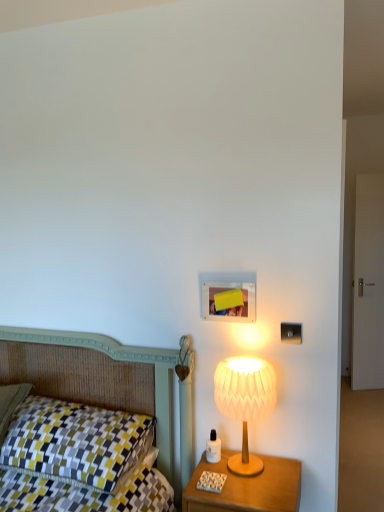
Question: From a real-world perspective, is white paper lampshade at right under wooden nightstand at right?

Choices:
 (A) yes
 (B) no

Answer: (B)

Question: Would you say white paper lampshade at right is a long distance from wooden nightstand at right?

Choices:
 (A) yes
 (B) no

Answer: (B)

Question: Is white paper lampshade at right at the right side of wooden nightstand at right?

Choices:
 (A) no
 (B) yes

Answer: (B)

Question: Can you confirm if white paper lampshade at right is smaller than wooden nightstand at right?

Choices:
 (A) no
 (B) yes

Answer: (B)

Question: Does white paper lampshade at right appear on the left side of wooden nightstand at right?

Choices:
 (A) no
 (B) yes

Answer: (A)

Question: Is white paper lampshade at right shorter than wooden nightstand at right?

Choices:
 (A) yes
 (B) no

Answer: (B)

Question: Is white paper lampshade at right taller than checkered fabric pillow at left?

Choices:
 (A) yes
 (B) no

Answer: (A)

Question: Is white paper lampshade at right aimed at checkered fabric pillow at left?

Choices:
 (A) yes
 (B) no

Answer: (B)

Question: Is white paper lampshade at right thinner than checkered fabric pillow at left?

Choices:
 (A) no
 (B) yes

Answer: (B)

Question: From a real-world perspective, is white paper lampshade at right positioned over checkered fabric pillow at left based on gravity?

Choices:
 (A) yes
 (B) no

Answer: (A)

Question: From the image's perspective, is white paper lampshade at right located above checkered fabric pillow at left?

Choices:
 (A) no
 (B) yes

Answer: (B)

Question: Is white paper lampshade at right smaller than checkered fabric pillow at left?

Choices:
 (A) no
 (B) yes

Answer: (B)

Question: From the image's perspective, is wooden nightstand at right located above checkered fabric pillow at left?

Choices:
 (A) yes
 (B) no

Answer: (B)